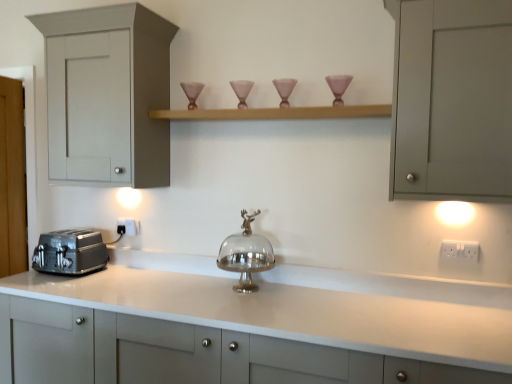
Question: Is wooden shelf at upper center oriented towards matte gray cabinet at left, which is the third cabinetry from bottom to top?

Choices:
 (A) no
 (B) yes

Answer: (A)

Question: Is wooden shelf at upper center not close to matte gray cabinet at left, which is the third cabinetry from bottom to top?

Choices:
 (A) no
 (B) yes

Answer: (A)

Question: Does wooden shelf at upper center have a lesser height compared to matte gray cabinet at left, which is the third cabinetry from bottom to top?

Choices:
 (A) yes
 (B) no

Answer: (A)

Question: Is wooden shelf at upper center next to matte gray cabinet at left, the first cabinetry in the top-to-bottom sequence, and touching it?

Choices:
 (A) no
 (B) yes

Answer: (A)

Question: Is the depth of wooden shelf at upper center less than that of matte gray cabinet at left, which is the third cabinetry from bottom to top?

Choices:
 (A) yes
 (B) no

Answer: (A)

Question: Is satin silver toaster at lower left in front of or behind matte pink glass candle holder at upper right in the image?

Choices:
 (A) behind
 (B) front

Answer: (A)

Question: Is satin silver toaster at lower left inside the boundaries of matte pink glass candle holder at upper right, or outside?

Choices:
 (A) outside
 (B) inside

Answer: (A)

Question: From a real-world perspective, is satin silver toaster at lower left physically located above or below matte pink glass candle holder at upper right?

Choices:
 (A) below
 (B) above

Answer: (A)

Question: Considering the relative positions of satin silver toaster at lower left and matte pink glass candle holder at upper right in the image provided, is satin silver toaster at lower left to the left or to the right of matte pink glass candle holder at upper right?

Choices:
 (A) right
 (B) left

Answer: (B)

Question: Considering the positions of matte pink glass candle holder at upper right and matte gray cabinet at left, the first cabinetry in the top-to-bottom sequence, in the image, is matte pink glass candle holder at upper right wider or thinner than matte gray cabinet at left, the first cabinetry in the top-to-bottom sequence,?

Choices:
 (A) thin
 (B) wide

Answer: (A)

Question: In terms of size, does matte pink glass candle holder at upper right appear bigger or smaller than matte gray cabinet at left, the first cabinetry in the top-to-bottom sequence?

Choices:
 (A) big
 (B) small

Answer: (B)

Question: Would you say matte pink glass candle holder at upper right is inside or outside matte gray cabinet at left, the first cabinetry in the top-to-bottom sequence?

Choices:
 (A) outside
 (B) inside

Answer: (A)

Question: Is point (339, 92) positioned closer to the camera than point (168, 33)?

Choices:
 (A) farther
 (B) closer

Answer: (B)

Question: Does point (138, 125) appear closer or farther from the camera than point (471, 249)?

Choices:
 (A) closer
 (B) farther

Answer: (B)

Question: Is matte gray cabinet at left, which is the third cabinetry from bottom to top, spatially inside white plastic electric outlet at right, which is the 1th electric outlet in front-to-back order, or outside of it?

Choices:
 (A) inside
 (B) outside

Answer: (B)